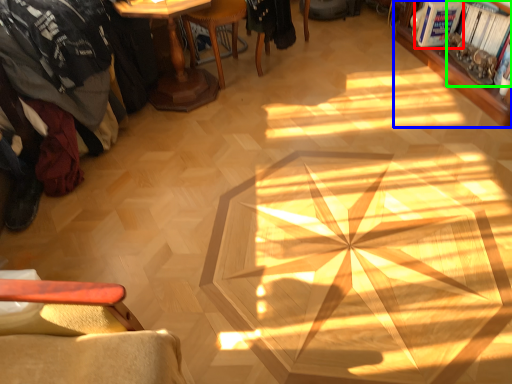
Question: Which is farther away from magazine (highlighted by a red box)? bookcase (highlighted by a blue box) or magazine (highlighted by a green box)?

Choices:
 (A) bookcase
 (B) magazine

Answer: (A)